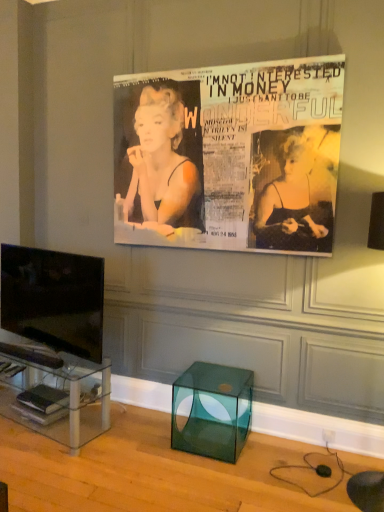
I want to click on free location in front of transparent glass cube at lower center, so click(214, 483).